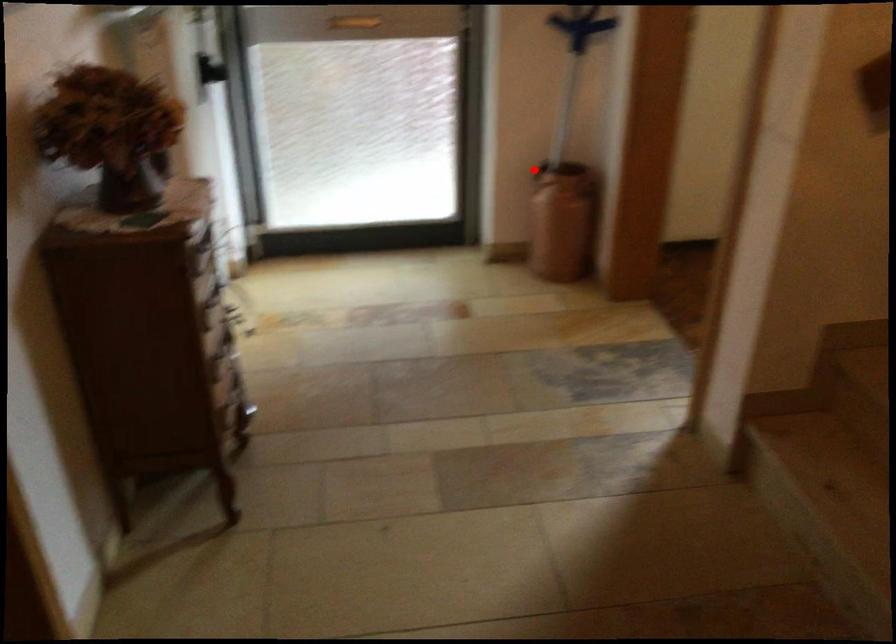
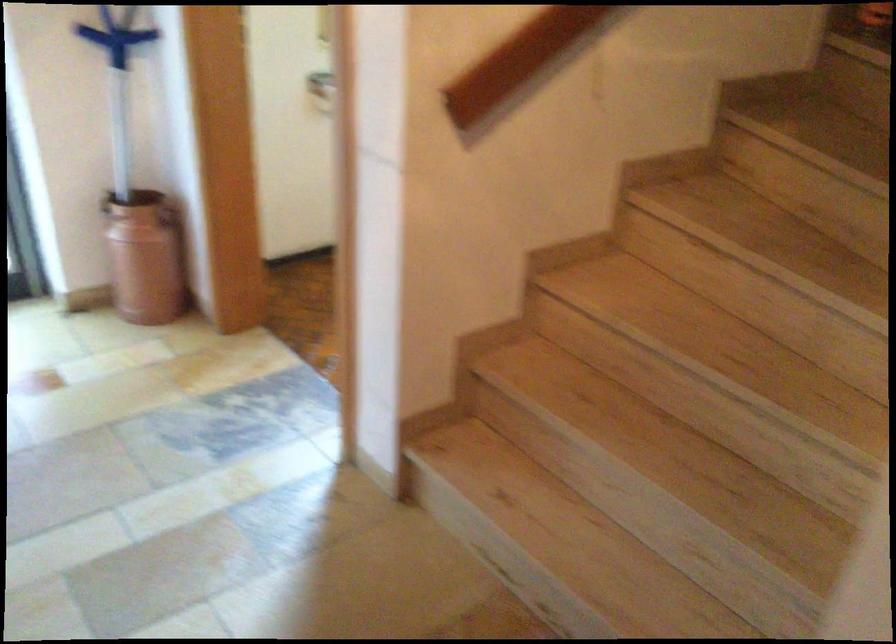
Question: I am providing you with two images of the same scene from different viewpoints. A red point is shown in image1. For the corresponding object point in image2, is it positioned nearer or farther from the camera?

Choices:
 (A) Nearer
 (B) Farther

Answer: (A)